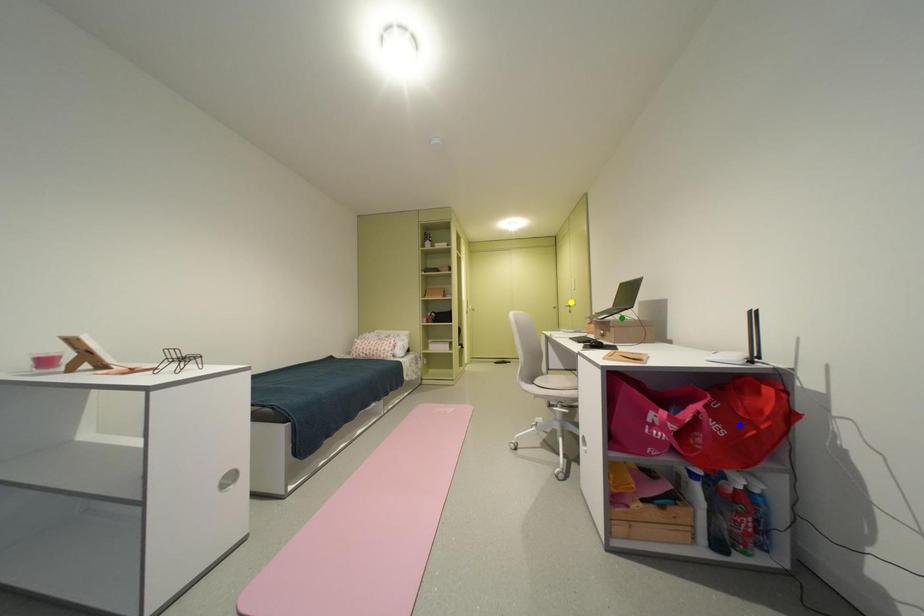
Order these from nearest to farthest:
yellow point | green point | blue point

blue point → green point → yellow point